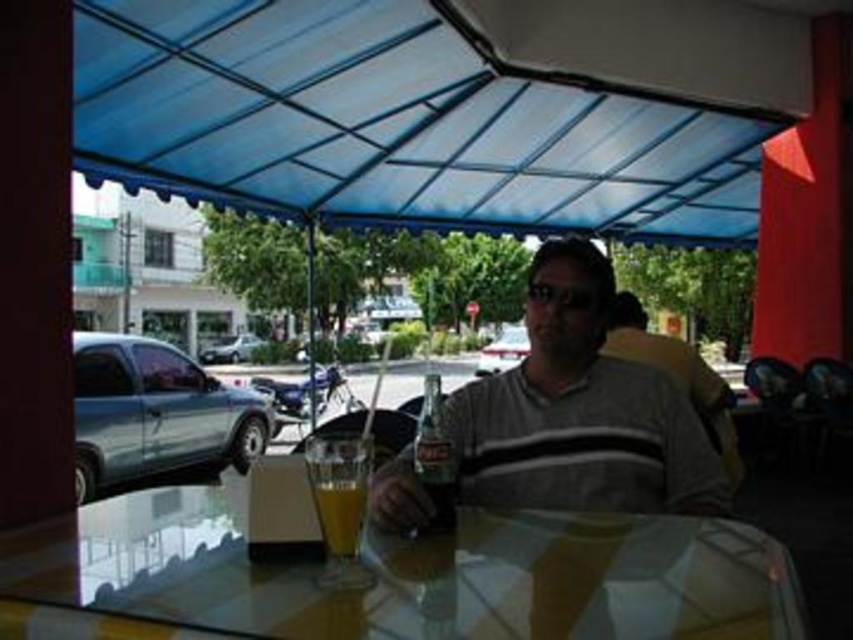
You are a customer at this outdoor cafe. You want to place your phone on the table so it won not fall off the edge. Considering the blue fabric canopy at upper center and the translucent glass cup at table center, which object can help you determine the table edge direction?

The blue fabric canopy at upper center is wider than the translucent glass cup at table center, so the canopy can help you determine the table edge direction because its larger size provides a better reference point for the table dimensions.

You are a photographer trying to capture the scene under the blue canopy. You need to ensure that the gray cotton shirt at center and the translucent glass cup at table center are both visible in your photo. Which object should you focus on first to ensure the wider subject is properly framed?

The gray cotton shirt at center has a larger width than the translucent glass cup at table center, so you should focus on the gray cotton shirt at center first to ensure the wider subject is properly framed.

Based on the photo, you are a waiter at the outdoor cafe under the blue canopy. You need to deliver a drink to the customer. The customer is sitting at the table where the gray cotton shirt at center and the translucent glass cup at table center are present. However, you notice something about the placement of these items that might cause an issue. What potential problem could there be with the current arrangement?

The gray cotton shirt at center is positioned over the translucent glass cup at table center, which means the shirt might be blocking access to the cup or could get stained if the cup is moved or spills occur.